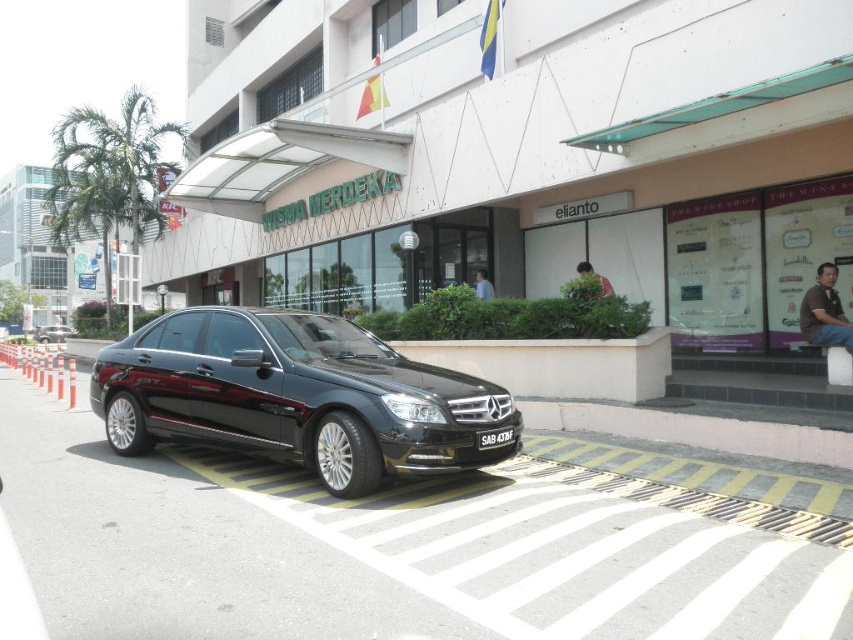
You are standing at the curb and want to cross the street to reach the black metallic car at center. The crosswalk is 10 feet away from you. If you walk straight towards the car, will you have to cross the street before reaching the car?

The black metallic car at center is 24.85 feet away from you. Since the crosswalk is only 10 feet away, you will need to cross the street before reaching the car.

You are a parking inspector checking if the black metallic car at center is properly parked. The license plate must be visible and not obstructed. Is the black plastic license plate at center positioned in a way that it can be easily seen from the front of the car?

The black metallic car at center and black plastic license plate at center are 3.61 meters apart, which means the license plate is likely positioned at the rear of the car. Since the car is parked facing forward, the license plate at the rear would be visible from the front only if the car is viewed from behind. Therefore, the license plate is not positioned in a way that it can be easily seen from the front of the car.